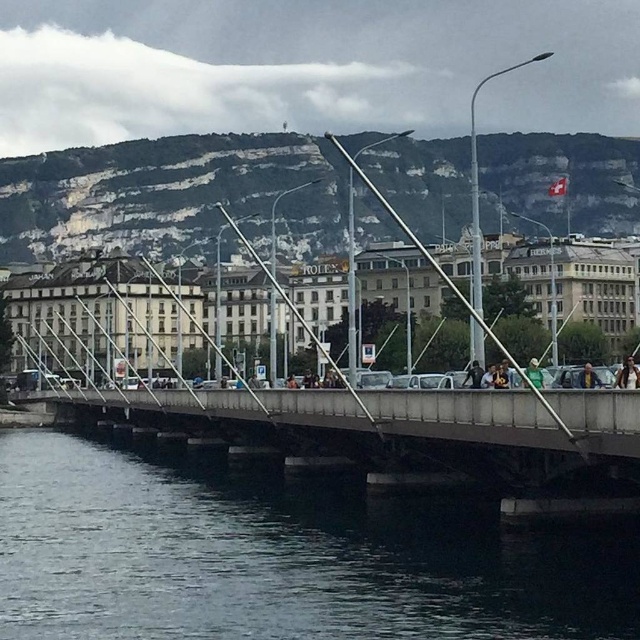
Question: Which of the following is the closest to the observer?

Choices:
 (A) dark brown leather jacket at center
 (B) light brown leather jacket at center

Answer: (A)

Question: Which object is the closest to the dark blue water at lower left?

Choices:
 (A) dark brown leather jacket at center
 (B) green fabric at center
 (C) light brown leather jacket at center

Answer: (B)

Question: Is dark brown leather jacket at center behind green fabric at center?

Choices:
 (A) no
 (B) yes

Answer: (A)

Question: Can you confirm if dark brown leather jacket at center is positioned to the right of green fabric at center?

Choices:
 (A) yes
 (B) no

Answer: (A)

Question: Which of these objects is positioned farthest from the dark brown leather jacket at center?

Choices:
 (A) dark blue water at lower left
 (B) light brown leather jacket at center

Answer: (A)

Question: Is dark brown leather jacket at center positioned behind green fabric at center?

Choices:
 (A) yes
 (B) no

Answer: (B)